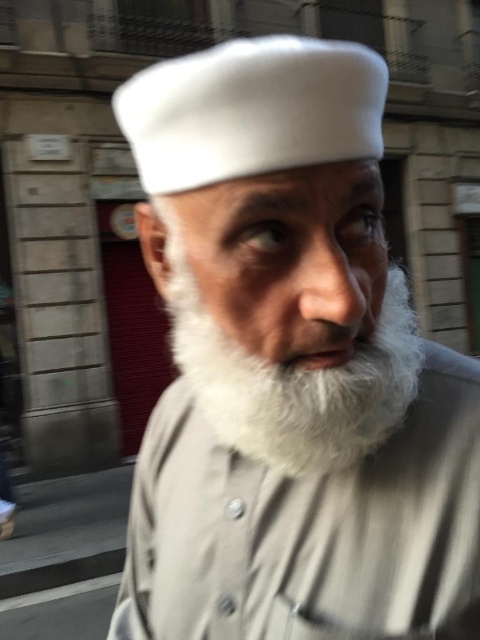
Is point (418, 616) more distant than point (355, 138)?

Yes, point (418, 616) is behind point (355, 138).

Who is shorter, white fur beard at center or white felt cap at upper center?

With less height is white fur beard at center.

Is point (268, 586) in front of point (244, 116)?

No, it is not.

Find the location of `white fur beard at center`. white fur beard at center is located at coordinates (309, 529).

Is white fur beard at center positioned in front of white soft beard at center?

No, it is not.

Does white fur beard at center have a greater height compared to white soft beard at center?

Yes.

In order to click on white fur beard at center in this screenshot , I will do `click(309, 529)`.

Where is `white fur beard at center`? white fur beard at center is located at coordinates (309, 529).

Who is more forward, (298, 147) or (218, 435)?

Point (298, 147) is in front.

Is point (254, 128) positioned after point (313, 401)?

That is False.

Where is `white felt cap at upper center`? The width and height of the screenshot is (480, 640). white felt cap at upper center is located at coordinates (252, 109).